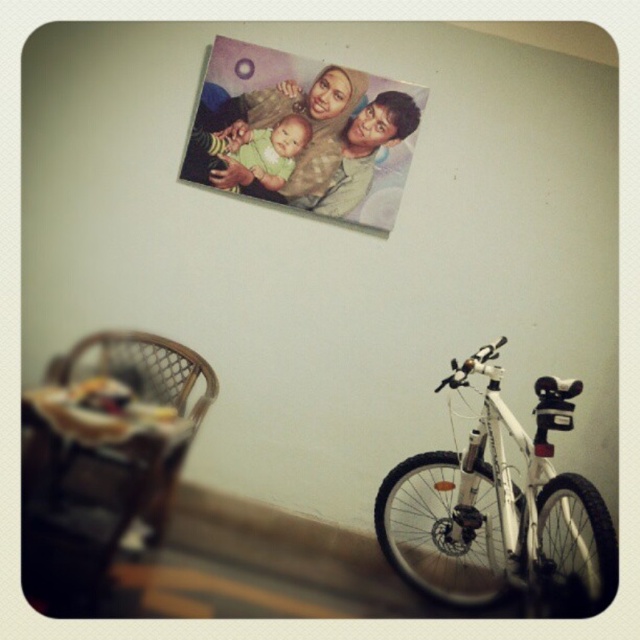
You are setting up a nursery and need to place both the wooden highchair at lower left and the woven rattan chair at lower left in the room. Given their sizes, which one requires more space?

The wooden highchair at lower left requires more space because it is larger in size than the woven rattan chair at lower left.

You are a parent carrying a baby and need to place them in one of the chairs. The baby requires a chair with at least 30 centimeters of space between the two chairs to safely move between them. Can you place the baby in either the wooden highchair at lower left or the woven rattan chair at lower left?

The distance between the wooden highchair at lower left and the woven rattan chair at lower left is 29.36 centimeters, which is less than the required 30 centimeters. Therefore, placing the baby in either chair would not provide enough space for safe movement between them.

You are standing in the room and want to sit down. There is a woven rattan chair at lower left located at point (140, 369). Can you sit on it?

Yes, you can sit on the woven rattan chair at lower left located at point (140, 369) as it is a chair designed for sitting.